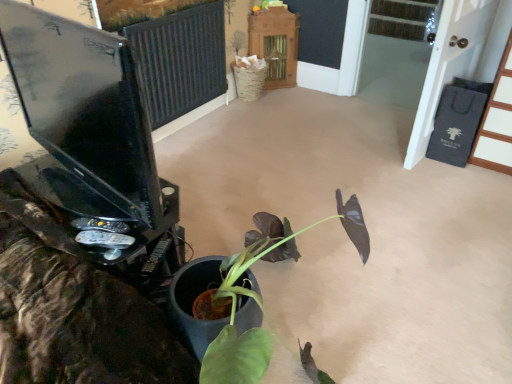
Question: Relative to matte black monitor at left, is black fabric screen door at right in front or behind?

Choices:
 (A) front
 (B) behind

Answer: (B)

Question: Is black fabric screen door at right inside or outside of matte black monitor at left?

Choices:
 (A) outside
 (B) inside

Answer: (A)

Question: Estimate the real-world distances between objects in this image. Which object is farther from the matte black monitor at left?

Choices:
 (A) black fabric screen door at right
 (B) wooden cabinet at upper center, marked as the 1th furniture in a back-to-front arrangement
 (C) black wood door at upper right, the first furniture from the front

Answer: (B)

Question: Which object is the closest to the black wood door at upper right, which is the second furniture from back to front?

Choices:
 (A) black fabric screen door at right
 (B) matte black monitor at left
 (C) wooden cabinet at upper center, arranged as the 2th furniture when viewed from the right

Answer: (A)